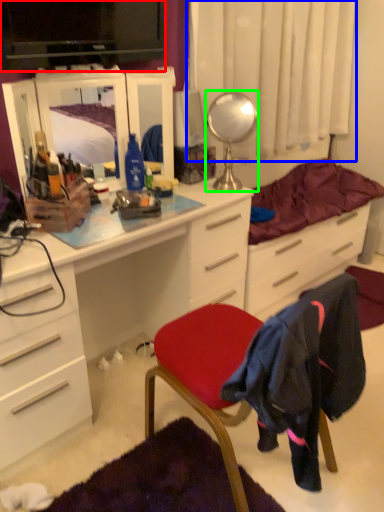
Question: Based on their relative distances, which object is farther from television (highlighted by a red box)? Choose from curtain (highlighted by a blue box) and mirror (highlighted by a green box).

Choices:
 (A) curtain
 (B) mirror

Answer: (A)